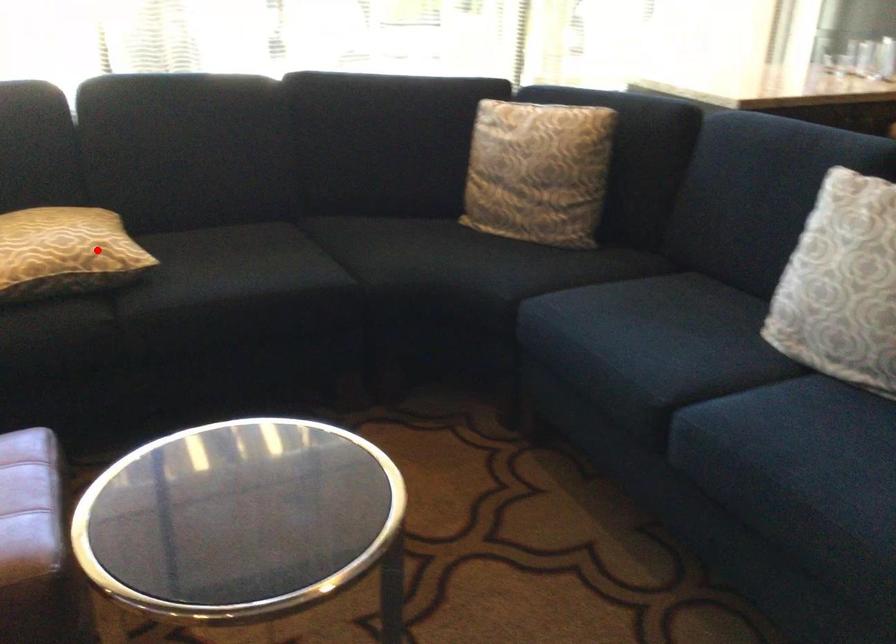
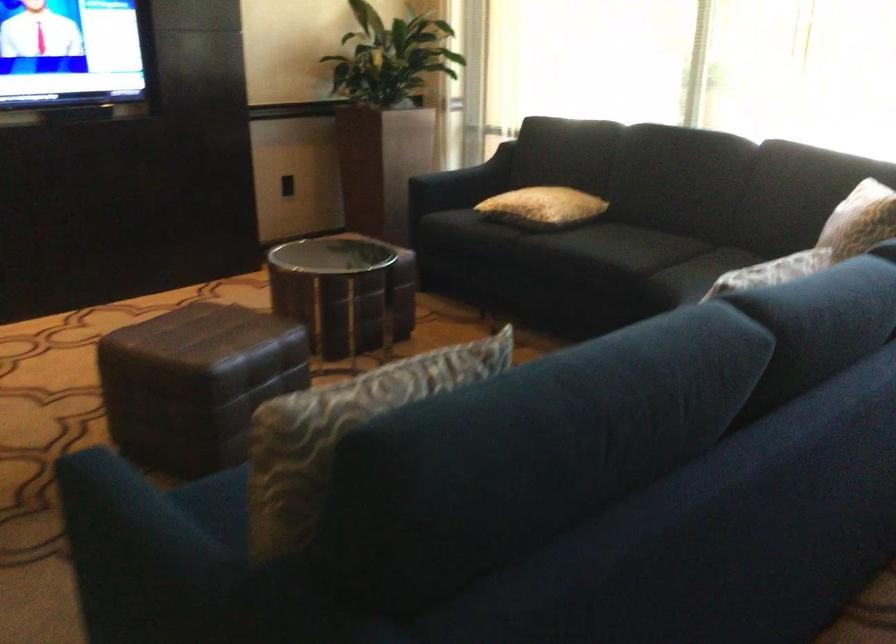
The point at the highlighted location is marked in the first image. Where is the corresponding point in the second image?

(543, 207)